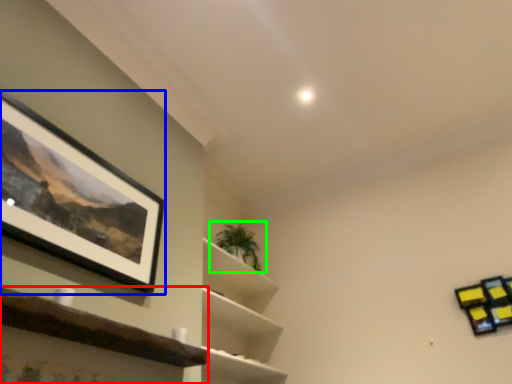
Question: Which object is the closest to the shelf (highlighted by a red box)? Choose among these: picture frame (highlighted by a blue box) or houseplant (highlighted by a green box).

Choices:
 (A) picture frame
 (B) houseplant

Answer: (A)